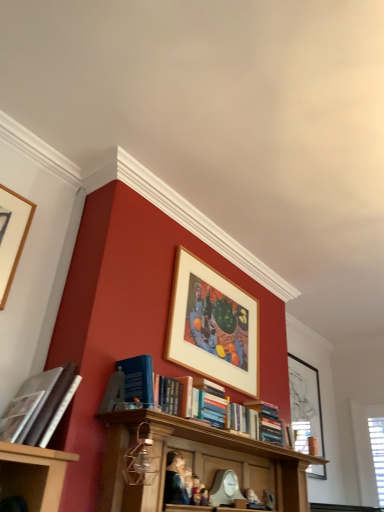
Question: Visually, is hardcover book at left, acting as the first book starting from the top, positioned to the left or to the right of smooth plastic figurine at center, which appears as the first person when viewed from the right?

Choices:
 (A) right
 (B) left

Answer: (B)

Question: From the image's perspective, is hardcover book at left, the 2th book ordered from the bottom, positioned above or below smooth plastic figurine at center, positioned as the 2th person in left-to-right order?

Choices:
 (A) below
 (B) above

Answer: (B)

Question: Considering the real-world distances, which object is farthest from the hardcover book at left, acting as the first book starting from the top?

Choices:
 (A) hardcover book at center, which is counted as the second book, starting from the left
 (B) black matte picture frame at upper right, which appears as the first picture frame when ordered from the bottom
 (C) wooden picture frame at upper left, the first picture frame in the front-to-back sequence
 (D) smooth plastic figurine at center, which appears as the first person when viewed from the right
 (E) smooth canvas portrait at center, positioned as the 2th person in right-to-left order

Answer: (B)

Question: Estimate the real-world distances between objects in this image. Which object is closer to the smooth canvas portrait at center, acting as the 1th person starting from the left?

Choices:
 (A) smooth plastic figurine at center, positioned as the 2th person in left-to-right order
 (B) wooden picture frame at upper center, the 2th picture frame in the back-to-front sequence
 (C) black matte picture frame at upper right, which is counted as the 1th picture frame, starting from the back
 (D) hardcover book at center, arranged as the 2th book when viewed from the front
 (E) wooden picture frame at upper left, placed as the third picture frame when sorted from back to front

Answer: (A)